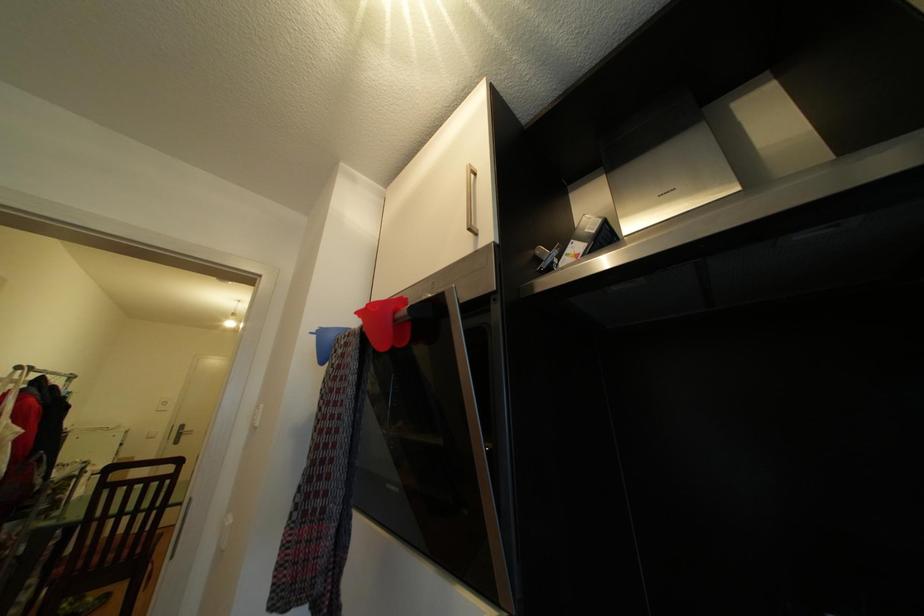
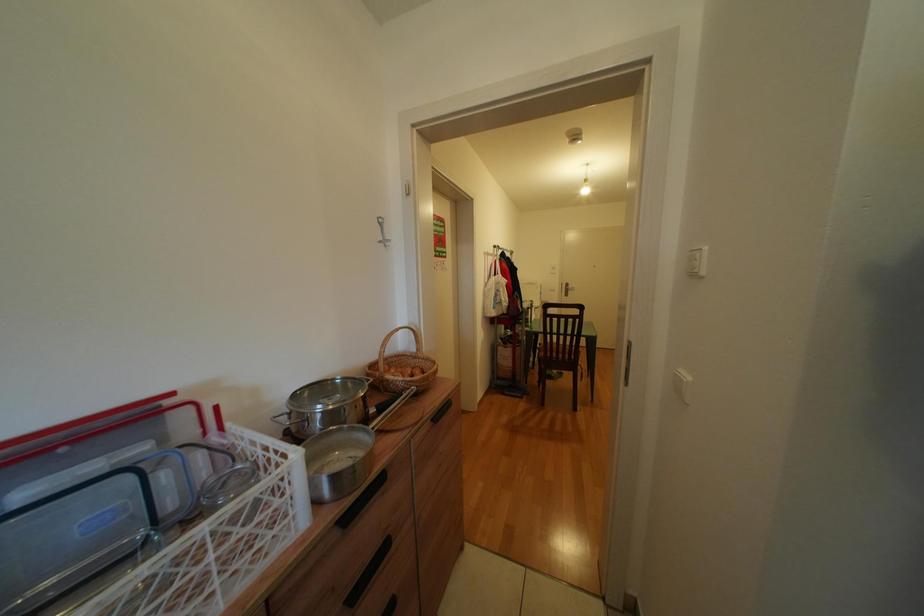
The images are taken continuously from a first-person perspective. In which direction is your viewpoint rotating?

The camera rotated toward left-down.